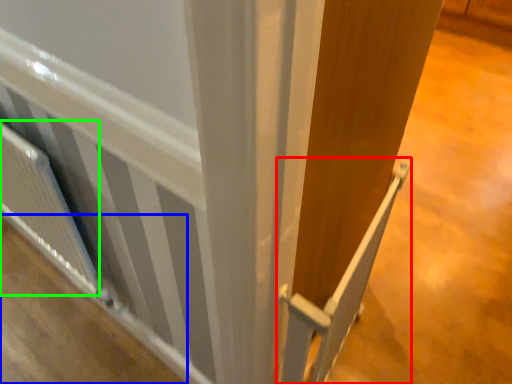
Question: Which is farther away from rail (highlighted by a red box)? plywood (highlighted by a blue box) or radiator (highlighted by a green box)?

Choices:
 (A) plywood
 (B) radiator

Answer: (A)